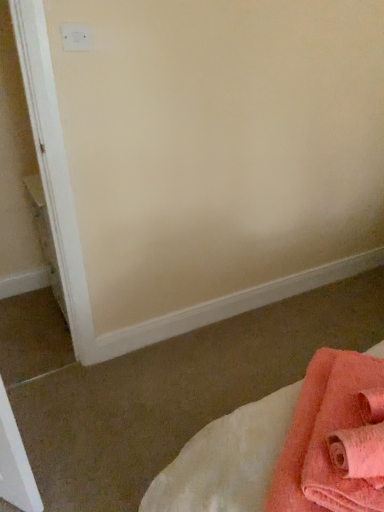
Question: Does soft pink towel at lower right come in front of white plastic electric outlet at upper left?

Choices:
 (A) yes
 (B) no

Answer: (A)

Question: Is soft pink towel at lower right thinner than white plastic electric outlet at upper left?

Choices:
 (A) no
 (B) yes

Answer: (A)

Question: Is soft pink towel at lower right facing towards white plastic electric outlet at upper left?

Choices:
 (A) yes
 (B) no

Answer: (B)

Question: Considering the relative positions of soft pink towel at lower right and white plastic electric outlet at upper left in the image provided, is soft pink towel at lower right behind white plastic electric outlet at upper left?

Choices:
 (A) no
 (B) yes

Answer: (A)

Question: Considering the relative sizes of soft pink towel at lower right and white plastic electric outlet at upper left in the image provided, is soft pink towel at lower right smaller than white plastic electric outlet at upper left?

Choices:
 (A) yes
 (B) no

Answer: (B)

Question: From the image's perspective, is soft pink towel at lower right located above or below soft coral towel at lower right?

Choices:
 (A) below
 (B) above

Answer: (B)

Question: Considering the positions of soft pink towel at lower right and soft coral towel at lower right in the image, is soft pink towel at lower right bigger or smaller than soft coral towel at lower right?

Choices:
 (A) big
 (B) small

Answer: (B)

Question: Based on their positions, is soft pink towel at lower right located to the left or right of soft coral towel at lower right?

Choices:
 (A) right
 (B) left

Answer: (A)

Question: From a real-world perspective, is soft pink towel at lower right positioned above or below soft coral towel at lower right?

Choices:
 (A) above
 (B) below

Answer: (A)

Question: Choose the correct answer: Is soft coral towel at lower right inside white plastic electric outlet at upper left or outside it?

Choices:
 (A) inside
 (B) outside

Answer: (B)

Question: From a real-world perspective, is soft coral towel at lower right positioned above or below white plastic electric outlet at upper left?

Choices:
 (A) below
 (B) above

Answer: (A)

Question: Is soft coral towel at lower right wider or thinner than white plastic electric outlet at upper left?

Choices:
 (A) wide
 (B) thin

Answer: (A)

Question: Considering the positions of point (309, 486) and point (82, 39), is point (309, 486) closer or farther from the camera than point (82, 39)?

Choices:
 (A) closer
 (B) farther

Answer: (A)

Question: Is soft pink towel at lower right in front of or behind white plastic electric outlet at upper left in the image?

Choices:
 (A) behind
 (B) front

Answer: (B)

Question: Considering the positions of soft pink towel at lower right and white plastic electric outlet at upper left in the image, is soft pink towel at lower right bigger or smaller than white plastic electric outlet at upper left?

Choices:
 (A) small
 (B) big

Answer: (B)